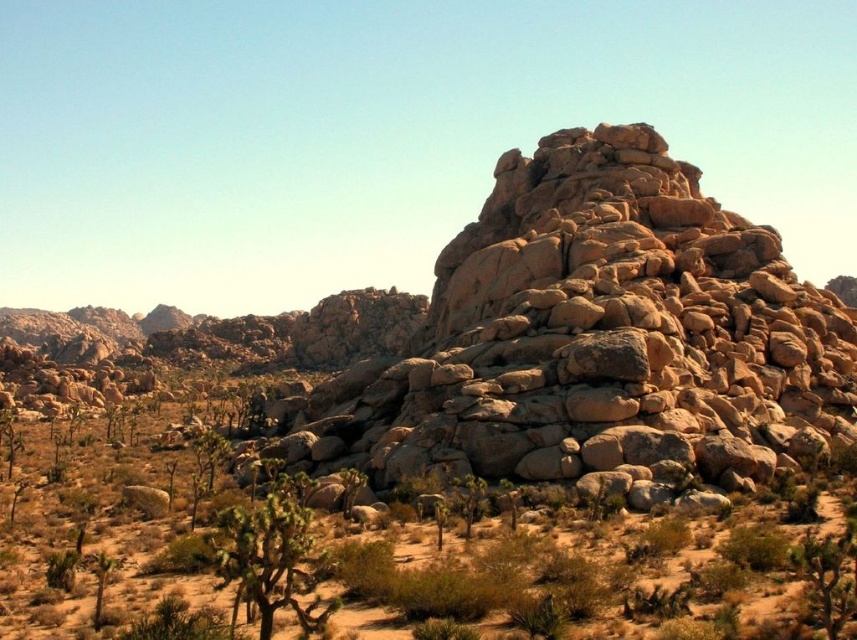
Which is behind, point (765, 582) or point (237, 518)?

The point (765, 582) is more distant.

In the scene shown: Which is below, green leafy bush at center or green leafy bush at lower center?

Result: green leafy bush at lower center is below.

Describe the element at coordinates (574, 556) in the screenshot. This screenshot has height=640, width=857. I see `green leafy bush at center` at that location.

Locate an element on the screen. This screenshot has width=857, height=640. green leafy bush at center is located at coordinates (574, 556).

Does rustic stone boulder at center appear over green leafy bush at lower center?

Indeed, rustic stone boulder at center is positioned over green leafy bush at lower center.

Is rustic stone boulder at center thinner than green leafy bush at lower center?

No.

Between point (788, 465) and point (310, 580), which one is positioned in front?

Point (310, 580) is in front.

You are a GUI agent. You are given a task and a screenshot of the screen. Output one action in this format:
    pyautogui.click(x=<x>, y=<y>)
    Task: Click on the rustic stone boulder at center
    The height and width of the screenshot is (640, 857).
    Given the screenshot: What is the action you would take?
    pyautogui.click(x=592, y=340)

Is rustic stone boulder at center above green leafy bush at center?

Indeed, rustic stone boulder at center is positioned over green leafy bush at center.

What do you see at coordinates (592, 340) in the screenshot? I see `rustic stone boulder at center` at bounding box center [592, 340].

Is point (532, 317) positioned before point (628, 589)?

No, (532, 317) is further to viewer.

This screenshot has height=640, width=857. I want to click on rustic stone boulder at center, so click(592, 340).